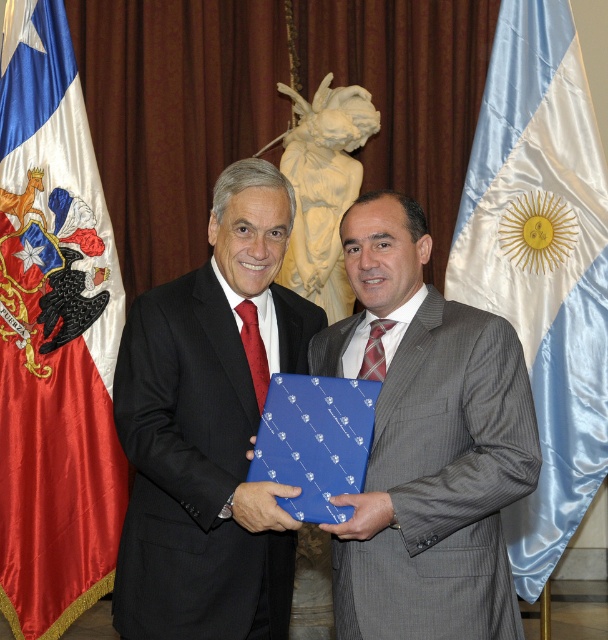
Question: Can you confirm if black matte suit at center is positioned to the left of gray pinstripe suit at center?

Choices:
 (A) no
 (B) yes

Answer: (B)

Question: Which object is closer to the camera taking this photo?

Choices:
 (A) blue satin flag at right
 (B) gray pinstripe suit at center

Answer: (B)

Question: Observing the image, what is the correct spatial positioning of black matte suit at center in reference to blue satin flag at right?

Choices:
 (A) right
 (B) left

Answer: (B)

Question: Which object appears closest to the camera in this image?

Choices:
 (A) gray pinstripe suit at center
 (B) blue satin flag at right

Answer: (A)

Question: Is gray pinstripe suit at center closer to the viewer compared to blue satin flag at right?

Choices:
 (A) yes
 (B) no

Answer: (A)

Question: Among these objects, which one is nearest to the camera?

Choices:
 (A) blue satin flag at right
 (B) black matte suit at center
 (C) blue paper/plastic at center
 (D) red satin flag at left

Answer: (C)